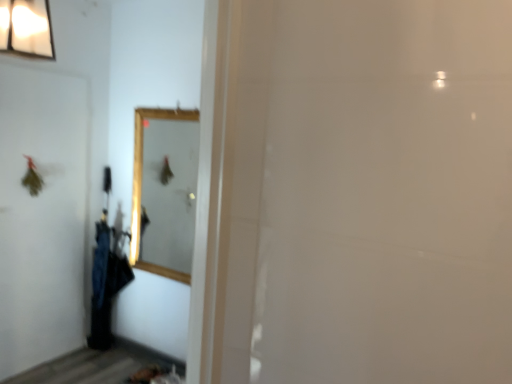
Question: From a real-world perspective, is black fabric umbrella at left positioned under wooden framed mirror at center based on gravity?

Choices:
 (A) no
 (B) yes

Answer: (B)

Question: Is black fabric umbrella at left placed right next to wooden framed mirror at center?

Choices:
 (A) yes
 (B) no

Answer: (B)

Question: Is wooden framed mirror at center at the back of black fabric umbrella at left?

Choices:
 (A) no
 (B) yes

Answer: (A)

Question: Can you confirm if black fabric umbrella at left is taller than wooden framed mirror at center?

Choices:
 (A) no
 (B) yes

Answer: (B)

Question: Considering the relative sizes of black fabric umbrella at left and wooden framed mirror at center in the image provided, is black fabric umbrella at left shorter than wooden framed mirror at center?

Choices:
 (A) no
 (B) yes

Answer: (A)

Question: Based on their positions, is wooden framed mirror at center located to the left or right of black fabric umbrella at left?

Choices:
 (A) right
 (B) left

Answer: (A)

Question: Is wooden framed mirror at center situated inside black fabric umbrella at left or outside?

Choices:
 (A) outside
 (B) inside

Answer: (A)

Question: From the image's perspective, relative to black fabric umbrella at left, is wooden framed mirror at center above or below?

Choices:
 (A) above
 (B) below

Answer: (A)

Question: Is wooden framed mirror at center wider or thinner than black fabric umbrella at left?

Choices:
 (A) thin
 (B) wide

Answer: (A)

Question: Would you say black fabric umbrella at left is inside or outside white matte screen door at left?

Choices:
 (A) outside
 (B) inside

Answer: (A)

Question: From a real-world perspective, is black fabric umbrella at left physically located above or below white matte screen door at left?

Choices:
 (A) below
 (B) above

Answer: (A)

Question: Is point (114, 246) positioned closer to the camera than point (23, 79)?

Choices:
 (A) farther
 (B) closer

Answer: (A)

Question: Looking at the image, does black fabric umbrella at left seem bigger or smaller compared to white matte screen door at left?

Choices:
 (A) big
 (B) small

Answer: (A)

Question: From the image's perspective, is white matte screen door at left above or below wooden framed mirror at center?

Choices:
 (A) above
 (B) below

Answer: (B)

Question: Looking at their shapes, would you say white matte screen door at left is wider or thinner than wooden framed mirror at center?

Choices:
 (A) wide
 (B) thin

Answer: (B)